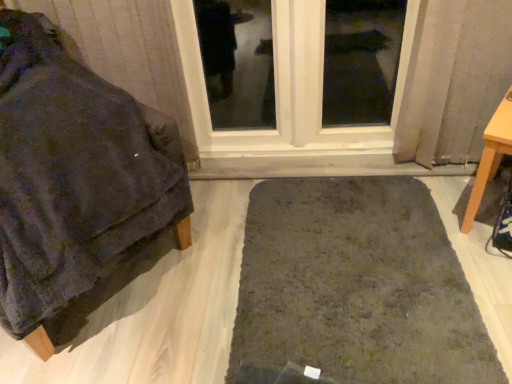
Question: In terms of height, does velvety dark gray blanket at left, which is counted as the first furniture, starting from the left, look taller or shorter compared to clear glass window at center?

Choices:
 (A) short
 (B) tall

Answer: (A)

Question: Based on their sizes in the image, would you say velvety dark gray blanket at left, which is counted as the first furniture, starting from the left, is bigger or smaller than clear glass window at center?

Choices:
 (A) small
 (B) big

Answer: (B)

Question: Which is farther from the velvety dark gray blanket at left, which is counted as the first furniture, starting from the left?

Choices:
 (A) dark green shaggy rug at center
 (B) light brown wooden table at right, the 2th furniture viewed from the left
 (C) clear glass window at center

Answer: (B)

Question: Estimate the real-world distances between objects in this image. Which object is farther from the dark green shaggy rug at center?

Choices:
 (A) light brown wooden table at right, the 2th furniture viewed from the left
 (B) velvety dark gray blanket at left, positioned as the second furniture in right-to-left order
 (C) clear glass window at center

Answer: (C)